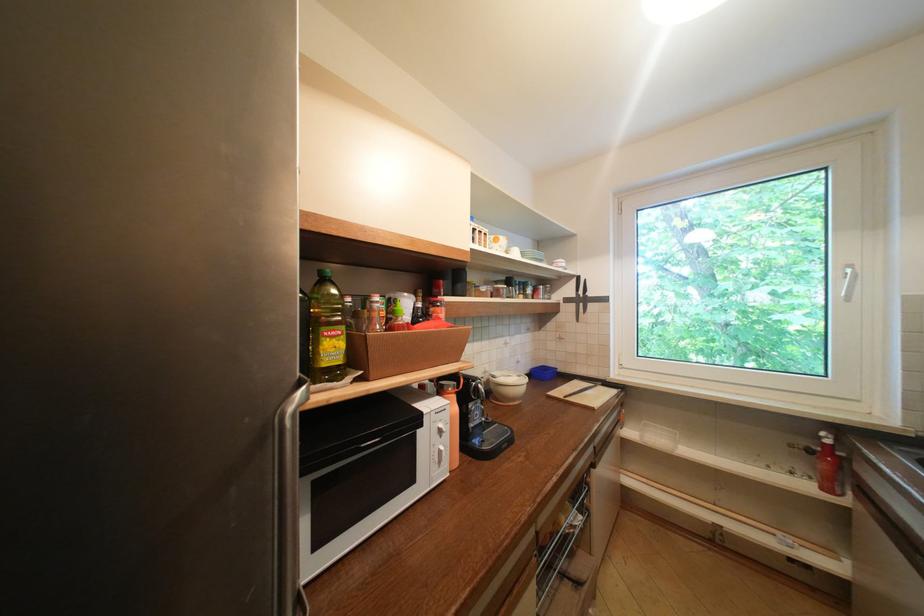
Where is `brown plastic basket`? The height and width of the screenshot is (616, 924). brown plastic basket is located at coordinates (404, 350).